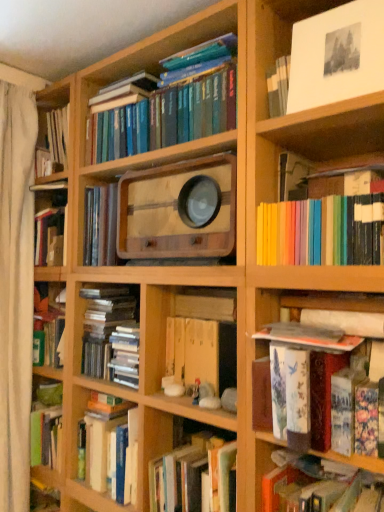
Question: Would you say hardcover book at lower right, which is the 5th book from top to bottom, is inside or outside white paper at upper right?

Choices:
 (A) inside
 (B) outside

Answer: (B)

Question: Considering the relative positions of hardcover book at lower right, acting as the first book starting from the bottom, and white paper at upper right in the image provided, is hardcover book at lower right, acting as the first book starting from the bottom, to the left or to the right of white paper at upper right?

Choices:
 (A) left
 (B) right

Answer: (A)

Question: Considering the real-world distances, which object is farthest from the blue hardcover books at upper center, which is the 1th book in top-to-bottom order?

Choices:
 (A) white paper at upper right
 (B) hardcover book at upper left, the 2th book in the top-to-bottom sequence
 (C) rainbow-colored paper at upper right, the third book in the bottom-to-top sequence
 (D) hardcover book at lower right, which is the 5th book from top to bottom
 (E) white fabric curtain at left

Answer: (D)

Question: Considering the real-world distances, which object is farthest from the white fabric curtain at left?

Choices:
 (A) hardcover book at upper left, the 2th book in the top-to-bottom sequence
 (B) blue hardcover books at upper center, the 5th book when ordered from bottom to top
 (C) rainbow-colored paper at upper right, the third book in the bottom-to-top sequence
 (D) white paper at upper right
 (E) hardcover book at lower right, which is the 5th book from top to bottom

Answer: (D)